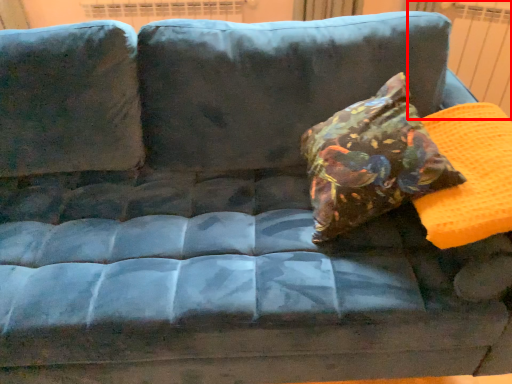
Question: In this image, where is radiator (annotated by the red box) located relative to throw pillow?

Choices:
 (A) right
 (B) left

Answer: (A)